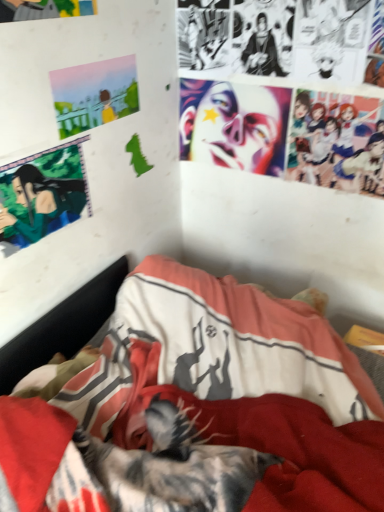
Question: Is shiny plastic face at upper center completely or partially outside of pastel acrylic painting at upper left?

Choices:
 (A) yes
 (B) no

Answer: (A)

Question: Can you confirm if shiny plastic face at upper center is smaller than pastel acrylic painting at upper left?

Choices:
 (A) no
 (B) yes

Answer: (A)

Question: From the image's perspective, does shiny plastic face at upper center appear higher than pastel acrylic painting at upper left?

Choices:
 (A) yes
 (B) no

Answer: (B)

Question: Is shiny plastic face at upper center wider than pastel acrylic painting at upper left?

Choices:
 (A) no
 (B) yes

Answer: (B)

Question: Could you tell me if shiny plastic face at upper center is turned towards pastel acrylic painting at upper left?

Choices:
 (A) no
 (B) yes

Answer: (B)

Question: Does point (200, 293) appear closer or farther from the camera than point (97, 94)?

Choices:
 (A) closer
 (B) farther

Answer: (B)

Question: Would you say textured fabric bed at center is inside or outside pastel acrylic painting at upper left?

Choices:
 (A) inside
 (B) outside

Answer: (B)

Question: Considering the positions of textured fabric bed at center and pastel acrylic painting at upper left in the image, is textured fabric bed at center taller or shorter than pastel acrylic painting at upper left?

Choices:
 (A) tall
 (B) short

Answer: (A)

Question: From a real-world perspective, is textured fabric bed at center positioned above or below pastel acrylic painting at upper left?

Choices:
 (A) above
 (B) below

Answer: (B)

Question: From the image's perspective, relative to green matte anime character at upper left, is pastel acrylic painting at upper left above or below?

Choices:
 (A) above
 (B) below

Answer: (A)

Question: Based on their positions, is pastel acrylic painting at upper left located to the left or right of green matte anime character at upper left?

Choices:
 (A) left
 (B) right

Answer: (B)

Question: Is pastel acrylic painting at upper left wider or thinner than green matte anime character at upper left?

Choices:
 (A) thin
 (B) wide

Answer: (B)

Question: From their relative heights in the image, would you say pastel acrylic painting at upper left is taller or shorter than green matte anime character at upper left?

Choices:
 (A) tall
 (B) short

Answer: (B)

Question: Would you say shiny plastic face at upper center is inside or outside green matte anime character at upper left?

Choices:
 (A) inside
 (B) outside

Answer: (B)

Question: From a real-world perspective, is shiny plastic face at upper center positioned above or below green matte anime character at upper left?

Choices:
 (A) above
 (B) below

Answer: (A)